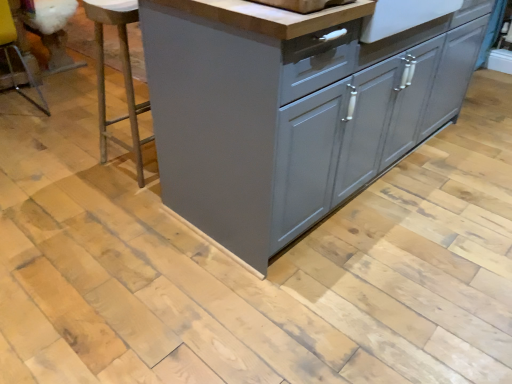
Question: Considering the relative positions of clear plastic bar stool at left, the first bar stool viewed from the left, and metallic silver bar stool at left, acting as the 2th bar stool starting from the left, in the image provided, is clear plastic bar stool at left, the first bar stool viewed from the left, to the right of metallic silver bar stool at left, acting as the 2th bar stool starting from the left, from the viewer's perspective?

Choices:
 (A) yes
 (B) no

Answer: (B)

Question: Is clear plastic bar stool at left, the second bar stool viewed from the right, touching metallic silver bar stool at left, which is counted as the first bar stool, starting from the right?

Choices:
 (A) yes
 (B) no

Answer: (B)

Question: Considering the relative sizes of clear plastic bar stool at left, the first bar stool viewed from the left, and metallic silver bar stool at left, which is counted as the first bar stool, starting from the right, in the image provided, is clear plastic bar stool at left, the first bar stool viewed from the left, taller than metallic silver bar stool at left, which is counted as the first bar stool, starting from the right,?

Choices:
 (A) no
 (B) yes

Answer: (A)

Question: Is clear plastic bar stool at left, the second bar stool viewed from the right, shorter than metallic silver bar stool at left, acting as the 2th bar stool starting from the left?

Choices:
 (A) no
 (B) yes

Answer: (B)

Question: Does clear plastic bar stool at left, the first bar stool viewed from the left, have a greater width compared to metallic silver bar stool at left, which is counted as the first bar stool, starting from the right?

Choices:
 (A) yes
 (B) no

Answer: (A)

Question: From a real-world perspective, does clear plastic bar stool at left, the first bar stool viewed from the left, sit lower than metallic silver bar stool at left, which is counted as the first bar stool, starting from the right?

Choices:
 (A) no
 (B) yes

Answer: (B)

Question: From a real-world perspective, is matte gray cabinet at center physically below clear plastic bar stool at left, the second bar stool viewed from the right?

Choices:
 (A) no
 (B) yes

Answer: (A)

Question: From the image's perspective, is matte gray cabinet at center above clear plastic bar stool at left, the second bar stool viewed from the right?

Choices:
 (A) yes
 (B) no

Answer: (B)

Question: Is matte gray cabinet at center touching clear plastic bar stool at left, the second bar stool viewed from the right?

Choices:
 (A) yes
 (B) no

Answer: (B)

Question: Is matte gray cabinet at center bigger than clear plastic bar stool at left, the first bar stool viewed from the left?

Choices:
 (A) no
 (B) yes

Answer: (B)

Question: From a real-world perspective, is matte gray cabinet at center physically above clear plastic bar stool at left, the second bar stool viewed from the right?

Choices:
 (A) no
 (B) yes

Answer: (B)

Question: Does matte gray cabinet at center appear on the right side of clear plastic bar stool at left, the first bar stool viewed from the left?

Choices:
 (A) no
 (B) yes

Answer: (B)

Question: Does clear plastic bar stool at left, the first bar stool viewed from the left, have a smaller size compared to matte gray cabinet at center?

Choices:
 (A) no
 (B) yes

Answer: (B)